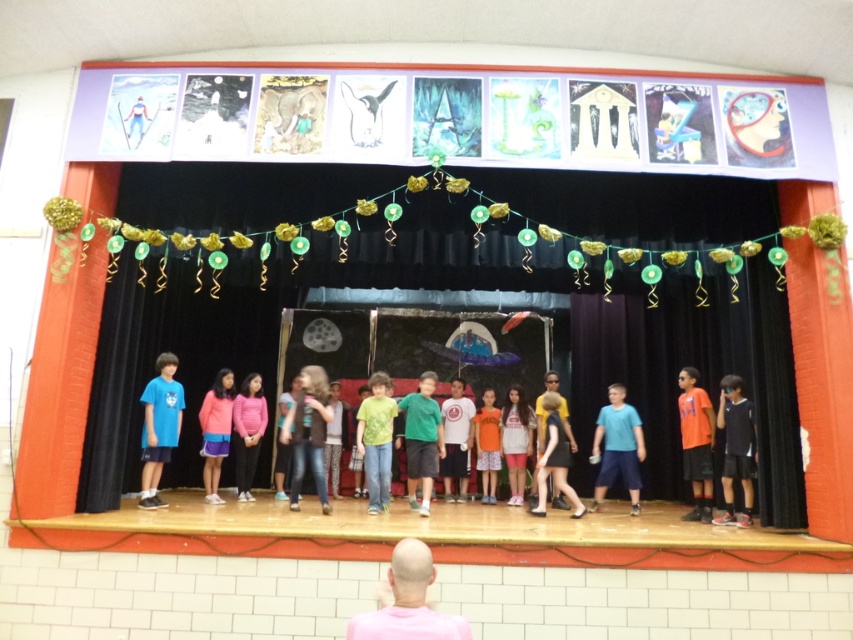
Question: Which of the following is the closest to the observer?

Choices:
 (A) pink cotton dress at center
 (B) pink matte shirt at lower center
 (C) pink fabric skirt at center
 (D) jeans at center

Answer: (B)

Question: Can you confirm if green matte shirt at center is positioned to the left of white cotton shirt at center?

Choices:
 (A) yes
 (B) no

Answer: (A)

Question: Can you confirm if black velvet curtain at center is positioned above pink cotton dress at center?

Choices:
 (A) yes
 (B) no

Answer: (A)

Question: Estimate the real-world distances between objects in this image. Which object is closer to the pink matte sweater at center?

Choices:
 (A) light brown fabric dress at center
 (B) green matte shirt at center
 (C) pink matte shirt at lower center

Answer: (B)

Question: Which point is farther from the camera taking this photo?

Choices:
 (A) (317, 442)
 (B) (257, 429)
 (C) (558, 448)

Answer: (B)

Question: Considering the relative positions of orange cotton shirt at right and orange cotton shirt at center in the image provided, where is orange cotton shirt at right located with respect to orange cotton shirt at center?

Choices:
 (A) right
 (B) left

Answer: (A)